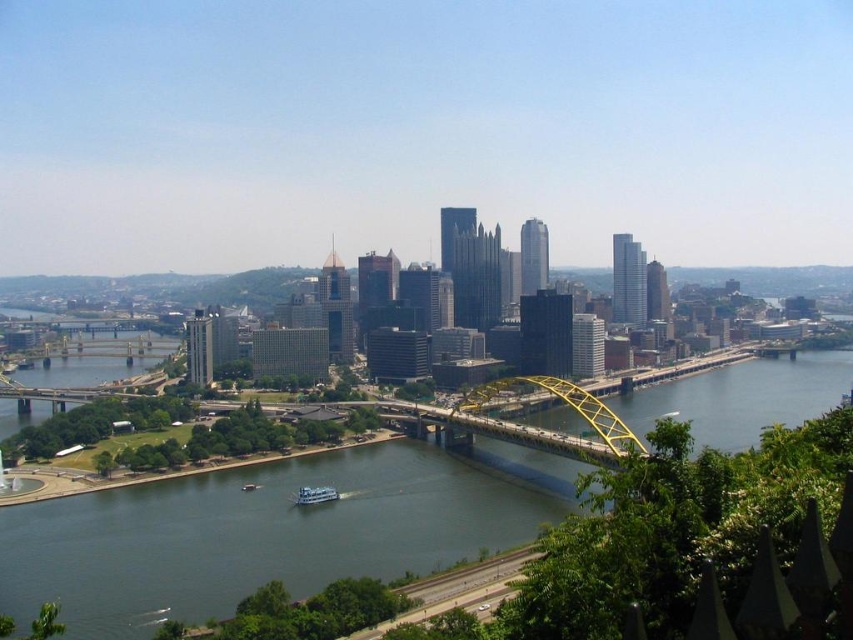
Which is in front, point (112, 524) or point (315, 490)?

Point (315, 490) is more forward.

Which is behind, point (283, 486) or point (300, 486)?

Positioned behind is point (283, 486).

Does point (225, 484) come behind point (325, 488)?

Yes, point (225, 484) is farther from viewer.

Find the location of a particular element. The width and height of the screenshot is (853, 640). greenish-blue water at center is located at coordinates (270, 531).

Between greenish-blue water at center and yellow metallic bridge at center, which one has more height?

greenish-blue water at center is taller.

Who is lower down, greenish-blue water at center or yellow metallic bridge at center?

greenish-blue water at center is below.

Where is `greenish-blue water at center`? The height and width of the screenshot is (640, 853). greenish-blue water at center is located at coordinates tap(270, 531).

Between yellow metallic bridge at center and white glossy boat at center, which one has more height?

With more height is yellow metallic bridge at center.

Who is positioned more to the left, yellow metallic bridge at center or white glossy boat at center?

Positioned to the left is white glossy boat at center.

Who is more distant from viewer, (503, 388) or (318, 499)?

The point (318, 499) is behind.

Where is `yellow metallic bridge at center`? The width and height of the screenshot is (853, 640). yellow metallic bridge at center is located at coordinates (524, 424).